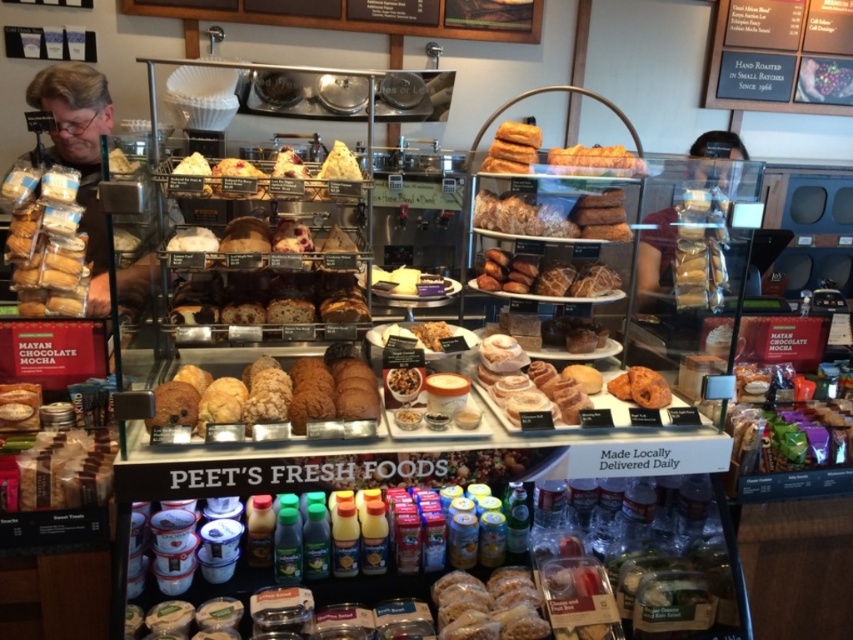
Is matte brown bagel at lower left smaller than translucent plastic baguette at center?

No.

Which is behind, point (85, 442) or point (515, 586)?

Positioned behind is point (515, 586).

The height and width of the screenshot is (640, 853). What do you see at coordinates (67, 468) in the screenshot? I see `matte brown bagel at lower left` at bounding box center [67, 468].

This screenshot has width=853, height=640. Identify the location of matte brown bagel at lower left. (67, 468).

Consider the image. Can you confirm if matte brown bagel at lower left is shorter than golden brown flaky pastry at upper center?

No.

Describe the element at coordinates (67, 468) in the screenshot. I see `matte brown bagel at lower left` at that location.

Between point (102, 429) and point (635, 160), which one is positioned in front?

Point (102, 429) is in front.

Find the location of `matte brown bagel at lower left`. matte brown bagel at lower left is located at coordinates (67, 468).

Describe the element at coordinates (45, 241) in the screenshot. The width and height of the screenshot is (853, 640). I see `matte brown pastries at left` at that location.

Who is positioned more to the left, matte brown pastries at left or translucent plastic baguette at center?

Positioned to the left is matte brown pastries at left.

Who is more distant from viewer, (62, 198) or (450, 630)?

The point (62, 198) is behind.

The width and height of the screenshot is (853, 640). What are the coordinates of `matte brown pastries at left` in the screenshot? It's located at (45, 241).